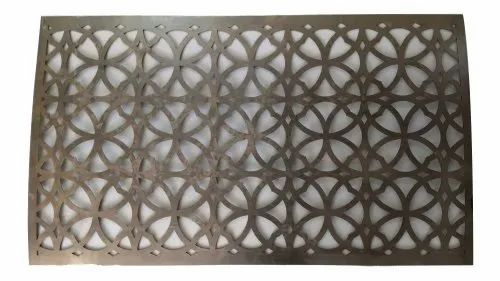
You are a GUI agent. You are given a task and a screenshot of the screen. Output one action in this format:
    pyautogui.click(x=<x>, y=<y>)
    Task: Click on the table
    
    Given the screenshot: What is the action you would take?
    pyautogui.click(x=311, y=223)